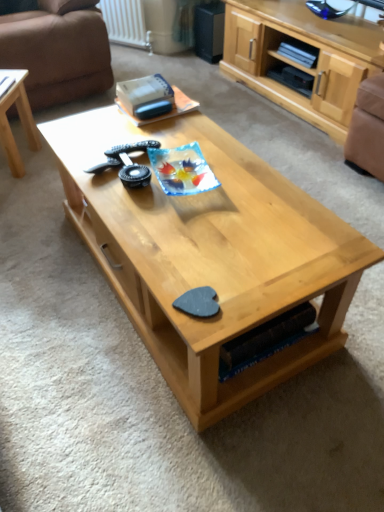
Find the location of `light wood/texture coffee table at left, which is the 1th coffee table in left-to-right order`. light wood/texture coffee table at left, which is the 1th coffee table in left-to-right order is located at coordinates (20, 120).

This screenshot has width=384, height=512. I want to click on brown leather couch at upper left, so click(x=57, y=54).

The height and width of the screenshot is (512, 384). Find the location of `white textured radiator at upper center`. white textured radiator at upper center is located at coordinates (126, 23).

Is light wood/texture coffee table at left, which is the 1th coffee table in left-to-right order, thinner than natural wood coffee table at center, which is the 2th coffee table in left-to-right order?

Correct, the width of light wood/texture coffee table at left, which is the 1th coffee table in left-to-right order, is less than that of natural wood coffee table at center, which is the 2th coffee table in left-to-right order.

Do you think light wood/texture coffee table at left, which is the second coffee table from right to left, is within natural wood coffee table at center, the 1th coffee table viewed from the right, or outside of it?

light wood/texture coffee table at left, which is the second coffee table from right to left, is spatially situated outside natural wood coffee table at center, the 1th coffee table viewed from the right.

From the image's perspective, relative to natural wood coffee table at center, which is the 2th coffee table in left-to-right order, is light wood/texture coffee table at left, which is the second coffee table from right to left, above or below?

From the image's perspective, light wood/texture coffee table at left, which is the second coffee table from right to left, appears above natural wood coffee table at center, which is the 2th coffee table in left-to-right order.

Is white textured radiator at upper center positioned with its back to brown leather couch at upper left?

white textured radiator at upper center is not turned away from brown leather couch at upper left.

From the picture: Are white textured radiator at upper center and brown leather couch at upper left making contact?

No, white textured radiator at upper center is not beside brown leather couch at upper left.

Based on their positions, is white textured radiator at upper center located to the left or right of brown leather couch at upper left?

white textured radiator at upper center is to the right of brown leather couch at upper left.

From a real-world perspective, is white textured radiator at upper center physically located above or below brown leather couch at upper left?

From a real-world perspective, white textured radiator at upper center is physically below brown leather couch at upper left.

Between light wood cabinet at upper right and natural wood coffee table at center, which is the 2th coffee table in left-to-right order, which one has larger width?

natural wood coffee table at center, which is the 2th coffee table in left-to-right order.

This screenshot has width=384, height=512. I want to click on cabinetry above the natural wood coffee table at center, the 1th coffee table viewed from the right (from a real-world perspective), so click(301, 64).

Which point is more distant from viewer, (345,27) or (296,271)?

Point (345,27)

Which is more to the right, light wood cabinet at upper right or natural wood coffee table at center, which is the 2th coffee table in left-to-right order?

light wood cabinet at upper right.

From a real-world perspective, does brown leather couch at upper left sit lower than brown fabric armchair at right?

No.

Considering the positions of objects brown leather couch at upper left and brown fabric armchair at right in the image provided, who is behind, brown leather couch at upper left or brown fabric armchair at right?

Positioned behind is brown leather couch at upper left.

Is brown leather couch at upper left not near brown fabric armchair at right?

Absolutely, brown leather couch at upper left is distant from brown fabric armchair at right.

Is natural wood coffee table at center, which is the 2th coffee table in left-to-right order, outside of light wood cabinet at upper right?

Yes.

Which object is thinner, natural wood coffee table at center, the 1th coffee table viewed from the right, or light wood cabinet at upper right?

light wood cabinet at upper right is thinner.

Is natural wood coffee table at center, which is the 2th coffee table in left-to-right order, not close to light wood cabinet at upper right?

natural wood coffee table at center, which is the 2th coffee table in left-to-right order, is far away from light wood cabinet at upper right.

Is point (306, 272) more distant than point (289, 108)?

No, (306, 272) is in front of (289, 108).

Is white textured radiator at upper center turned away from brown fabric armchair at right?

No, brown fabric armchair at right is not at the back of white textured radiator at upper center.

Can you confirm if white textured radiator at upper center is wider than brown fabric armchair at right?

In fact, white textured radiator at upper center might be narrower than brown fabric armchair at right.

At what (x,y) coordinates should I click in order to perform the action: click on armchair on the right of white textured radiator at upper center. Please return your answer as a coordinate pair (x, y). Looking at the image, I should click on (367, 129).

Would you consider white textured radiator at upper center to be distant from brown fabric armchair at right?

Yes, white textured radiator at upper center is far from brown fabric armchair at right.

From a real-world perspective, between brown fabric armchair at right and light wood cabinet at upper right, who is vertically higher?

Result: light wood cabinet at upper right.

Is point (370, 145) closer or farther from the camera than point (264, 93)?

Point (370, 145).

Considering the sizes of brown fabric armchair at right and light wood cabinet at upper right in the image, is brown fabric armchair at right taller or shorter than light wood cabinet at upper right?

Clearly, brown fabric armchair at right is shorter compared to light wood cabinet at upper right.

How many degrees apart are the facing directions of brown fabric armchair at right and light wood cabinet at upper right?

brown fabric armchair at right and light wood cabinet at upper right are facing 2.05 degrees away from each other.

Locate an element on the screen. The height and width of the screenshot is (512, 384). coffee table in front of the light wood/texture coffee table at left, which is the 1th coffee table in left-to-right order is located at coordinates (209, 254).

You are a GUI agent. You are given a task and a screenshot of the screen. Output one action in this format:
    pyautogui.click(x=<x>, y=<y>)
    Task: Click on the radiator on the right side of brown leather couch at upper left
    The height and width of the screenshot is (512, 384).
    Given the screenshot: What is the action you would take?
    pyautogui.click(x=126, y=23)

From the image, which object appears to be farther from white textured radiator at upper center, light wood cabinet at upper right or brown fabric armchair at right?

brown fabric armchair at right is positioned further to the anchor white textured radiator at upper center.

Based on their spatial positions, is natural wood coffee table at center, which is the 2th coffee table in left-to-right order, or light wood/texture coffee table at left, which is the 1th coffee table in left-to-right order, further from white textured radiator at upper center?

Among the two, natural wood coffee table at center, which is the 2th coffee table in left-to-right order, is located further to white textured radiator at upper center.

Looking at this image, based on their spatial positions, is brown leather couch at upper left or light wood cabinet at upper right closer to brown fabric armchair at right?

The object closer to brown fabric armchair at right is light wood cabinet at upper right.

Estimate the real-world distances between objects in this image. Which object is closer to brown leather couch at upper left, light wood/texture coffee table at left, which is the second coffee table from right to left, or natural wood coffee table at center, the 1th coffee table viewed from the right?

The object closer to brown leather couch at upper left is light wood/texture coffee table at left, which is the second coffee table from right to left.

When comparing their distances from brown fabric armchair at right, does light wood cabinet at upper right or natural wood coffee table at center, the 1th coffee table viewed from the right, seem further?

natural wood coffee table at center, the 1th coffee table viewed from the right, is further to brown fabric armchair at right.

Which object lies further to the anchor point light wood/texture coffee table at left, which is the 1th coffee table in left-to-right order, natural wood coffee table at center, the 1th coffee table viewed from the right, or brown leather couch at upper left?

natural wood coffee table at center, the 1th coffee table viewed from the right, is further to light wood/texture coffee table at left, which is the 1th coffee table in left-to-right order.

When comparing their distances from light wood cabinet at upper right, does natural wood coffee table at center, the 1th coffee table viewed from the right, or brown fabric armchair at right seem further?

Among the two, natural wood coffee table at center, the 1th coffee table viewed from the right, is located further to light wood cabinet at upper right.

Based on the photo, considering their positions, is brown leather couch at upper left positioned closer to white textured radiator at upper center than light wood cabinet at upper right?

brown leather couch at upper left is positioned closer to the anchor white textured radiator at upper center.

Identify the location of studio couch located between natural wood coffee table at center, the 1th coffee table viewed from the right, and white textured radiator at upper center in the depth direction. (57, 54).

The width and height of the screenshot is (384, 512). Find the location of `coffee table positioned between natural wood coffee table at center, the 1th coffee table viewed from the right, and white textured radiator at upper center from near to far`. coffee table positioned between natural wood coffee table at center, the 1th coffee table viewed from the right, and white textured radiator at upper center from near to far is located at coordinates (20, 120).

Where is `coffee table situated between light wood/texture coffee table at left, which is the second coffee table from right to left, and brown fabric armchair at right from left to right`? The height and width of the screenshot is (512, 384). coffee table situated between light wood/texture coffee table at left, which is the second coffee table from right to left, and brown fabric armchair at right from left to right is located at coordinates (209, 254).

Find the location of a particular element. armchair between light wood cabinet at upper right and natural wood coffee table at center, the 1th coffee table viewed from the right, in the vertical direction is located at coordinates coord(367,129).